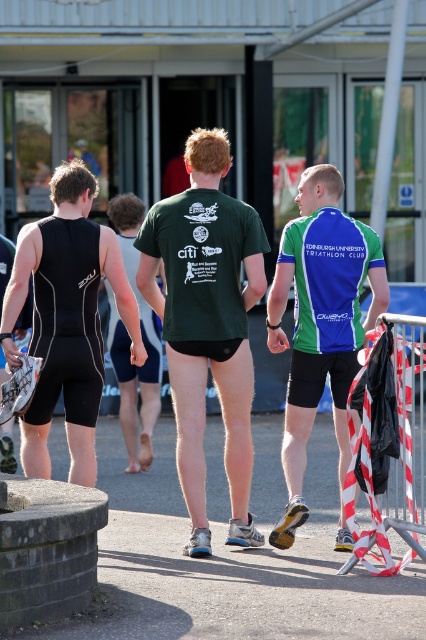
What is the position of the point at coordinates (321, 323) in the image?

The point at coordinates (321, 323) is located on the green or blue jersey worn by the individual at the center of the image.

You are an event organizer who needs to set up a starting line for a race. The red and white striped tape at right marks the starting point, and the green matte shorts at center belong to an athlete. How far apart are these two points?

The distance between the red and white striped tape at right and the green matte shorts at center is 3.58 meters.

You are standing in the scene and want to throw a ball to either point A at point (397,477) or point B at point (138,224). Which point is closer to you?

Point A at point (397,477) is closer to you than point B at point (138,224).